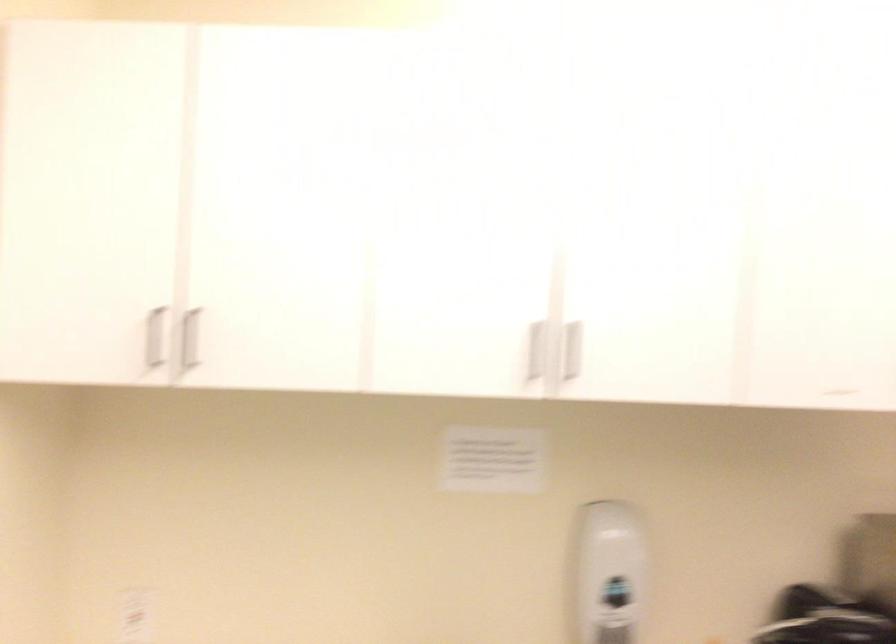
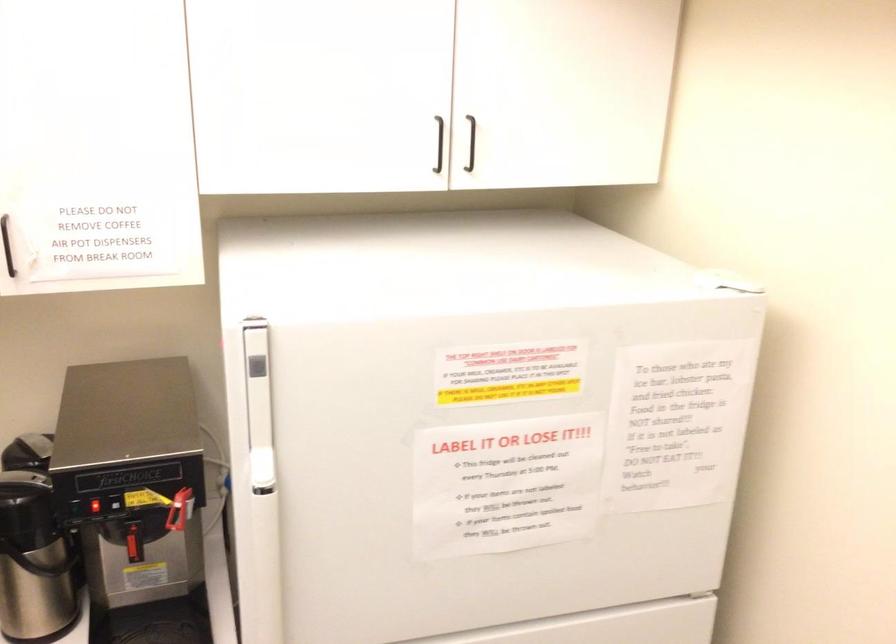
From the picture: Based on the continuous images, in which direction is the camera rotating?

The rotation direction of the camera is right-down.